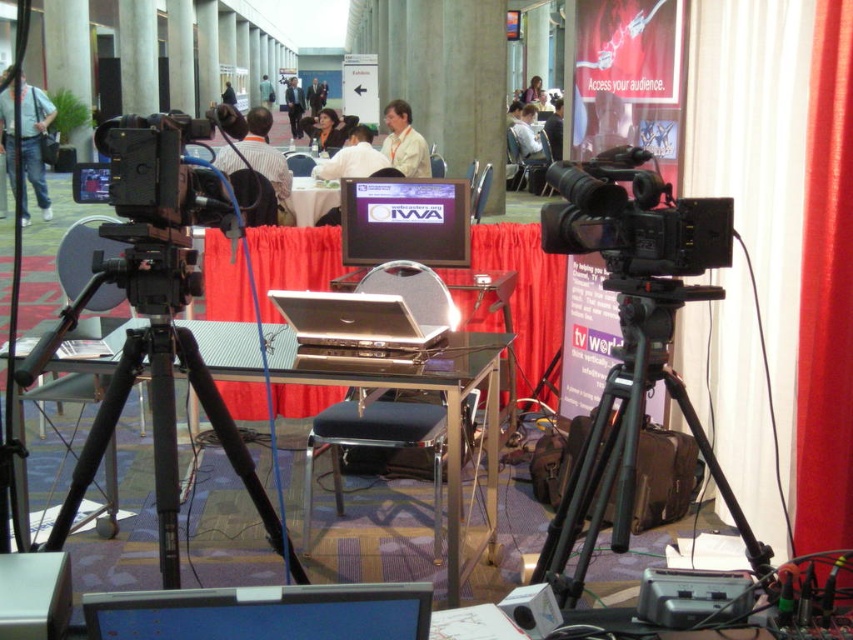
Is point (434, 488) closer to camera compared to point (531, 122)?

Yes, point (434, 488) is closer to viewer.

The image size is (853, 640). I want to click on black leather stool at center, so click(x=375, y=445).

At what (x,y) coordinates should I click in order to perform the action: click on black leather stool at center. Please return your answer as a coordinate pair (x, y). The height and width of the screenshot is (640, 853). Looking at the image, I should click on (375, 445).

Which of these two, matte black monitor at center or silver metallic laptop at center, stands taller?

Standing taller between the two is matte black monitor at center.

Image resolution: width=853 pixels, height=640 pixels. What do you see at coordinates (404, 221) in the screenshot?
I see `matte black monitor at center` at bounding box center [404, 221].

Is point (364, 227) closer to camera compared to point (381, 312)?

That is False.

The height and width of the screenshot is (640, 853). In order to click on matte black monitor at center in this screenshot , I will do `click(404, 221)`.

Can you confirm if red velvet curtain at right is positioned to the right of light brown leather jacket at center?

Correct, you'll find red velvet curtain at right to the right of light brown leather jacket at center.

Measure the distance between red velvet curtain at right and light brown leather jacket at center.

red velvet curtain at right is 18.39 meters away from light brown leather jacket at center.

Measure the distance between red velvet curtain at right and camera.

red velvet curtain at right and camera are 7.23 feet apart.

I want to click on red velvet curtain at right, so click(x=827, y=294).